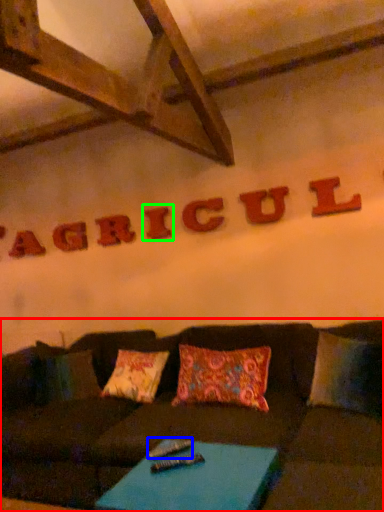
Question: Estimate the real-world distances between objects in this image. Which object is closer to studio couch (highlighted by a red box), remote (highlighted by a blue box) or letter (highlighted by a green box)?

Choices:
 (A) remote
 (B) letter

Answer: (A)